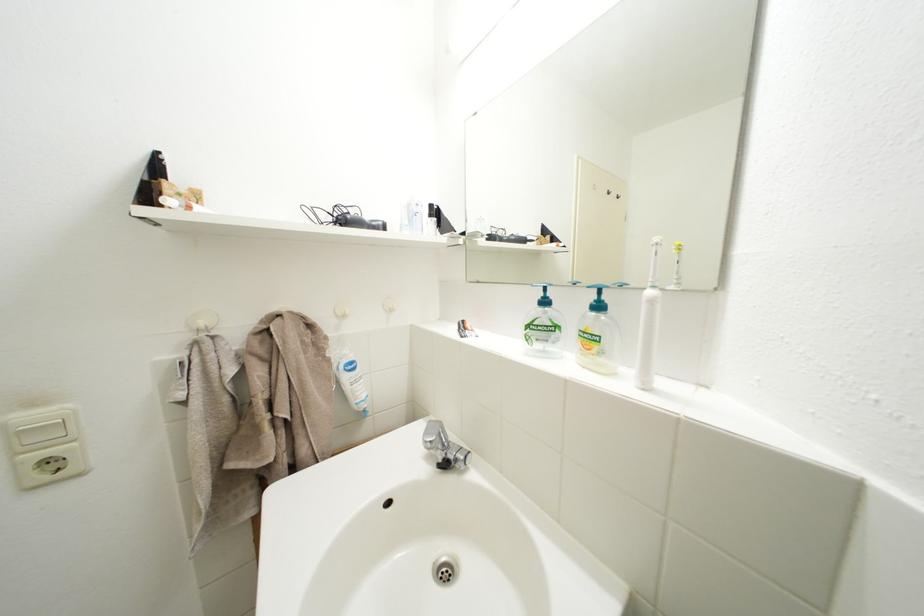
Find where to lift the faucet handle. Please return your answer as a coordinate pair (x, y).

(434, 437)